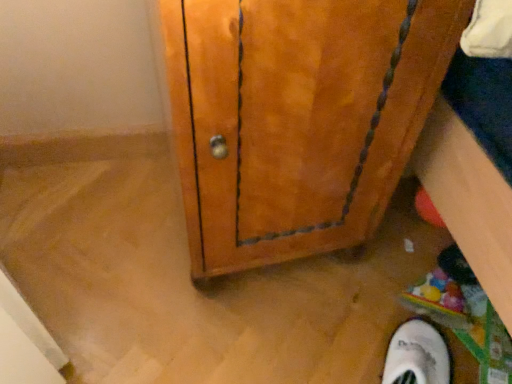
This screenshot has width=512, height=384. I want to click on free point to the left of wooden cabinet at center, so click(x=95, y=230).